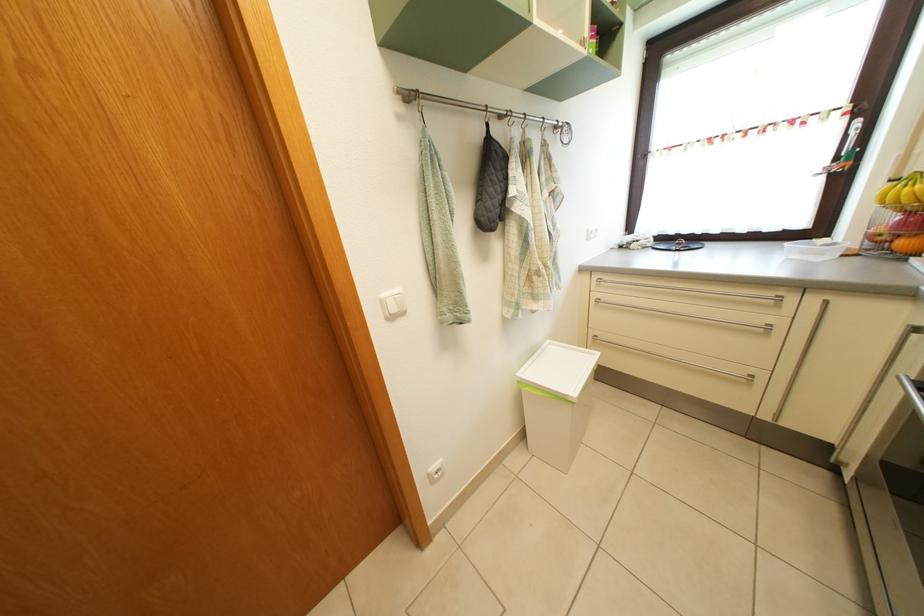
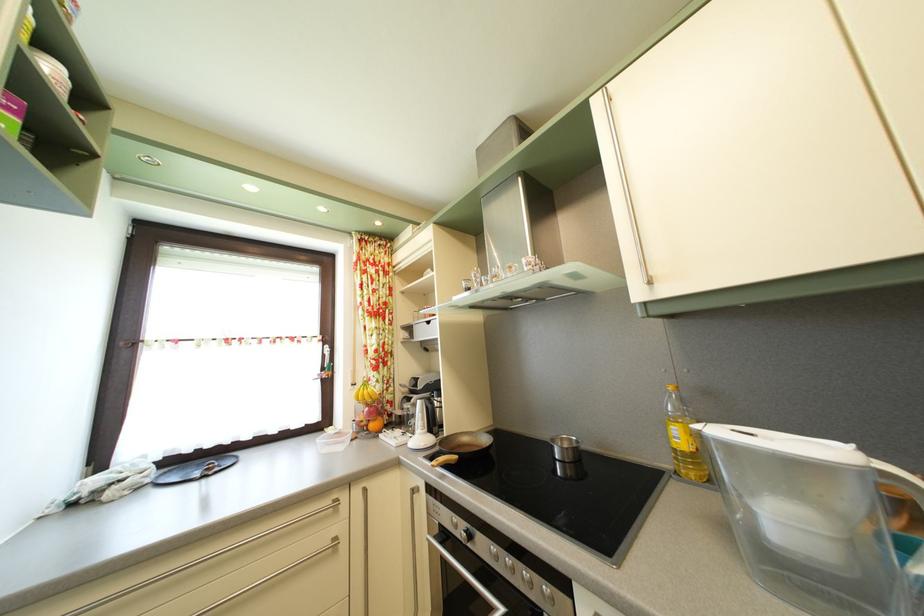
The first image is from the beginning of the video and the second image is from the end. How did the camera likely rotate when shooting the video?

The rotation direction of the camera is right-up.